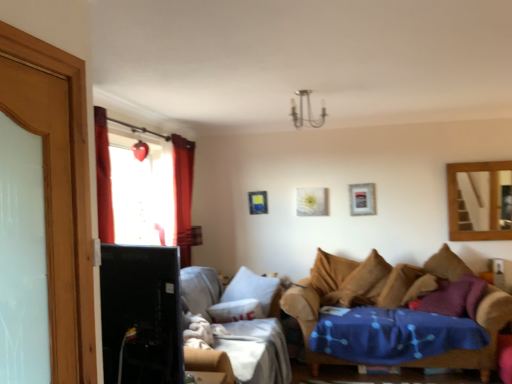
Question: From a real-world perspective, is velvet brown couch at lower right, the 1th studio couch when ordered from right to left, physically located above or below wooden mirror at upper right?

Choices:
 (A) above
 (B) below

Answer: (B)

Question: Considering the relative positions of velvet brown couch at lower right, the 1th studio couch when ordered from right to left, and wooden mirror at upper right in the image provided, is velvet brown couch at lower right, the 1th studio couch when ordered from right to left, to the left or to the right of wooden mirror at upper right?

Choices:
 (A) left
 (B) right

Answer: (A)

Question: Which object is the farthest from the white matte picture frame at upper center, which is the 2th picture frame in back-to-front order?

Choices:
 (A) black glossy tv at left
 (B) matte blue picture frame at center, which is counted as the third picture frame, starting from the right
 (C) wooden screen door at left
 (D) brown fabric pillow at right, acting as the 1th pillow starting from the left
 (E) metallic silver picture frame at upper center, which ranks as the 1th picture frame in front-to-back order

Answer: (C)

Question: Estimate the real-world distances between objects in this image. Which object is farther from the wooden screen door at left?

Choices:
 (A) velvet brown couch at lower right, the second studio couch when ordered from left to right
 (B) black glossy tv at left
 (C) matte blue picture frame at center, which is counted as the third picture frame, starting from the right
 (D) white matte picture frame at upper center, which is the second picture frame in right-to-left order
 (E) metallic silver picture frame at upper center, which ranks as the 1th picture frame in front-to-back order

Answer: (E)